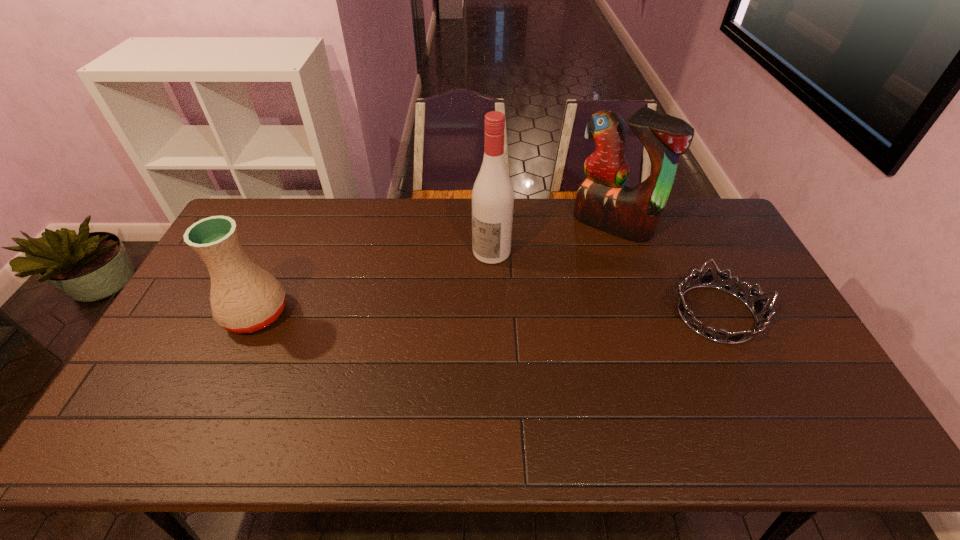
The height and width of the screenshot is (540, 960). Find the location of `pottery`. pottery is located at coordinates (244, 298).

Identify the location of the third tallest object. (244, 298).

At what (x,y) coordinates should I click in order to perform the action: click on the shortest object. Please return your answer as a coordinate pair (x, y). Looking at the image, I should click on (707, 279).

Where is `parrot`? This screenshot has width=960, height=540. parrot is located at coordinates (603, 200).

This screenshot has width=960, height=540. I want to click on the second object from left to right, so click(493, 195).

The height and width of the screenshot is (540, 960). Find the location of `free location located 0.060m on the right of the second shortest object`. free location located 0.060m on the right of the second shortest object is located at coordinates (310, 314).

I want to click on blank area located on the front-facing side of the tiara, so click(577, 314).

Where is `free space located 0.350m on the front-facing side of the tiara`? The height and width of the screenshot is (540, 960). free space located 0.350m on the front-facing side of the tiara is located at coordinates (549, 314).

This screenshot has height=540, width=960. I want to click on vacant area situated on the front-facing side of the tiara, so click(625, 314).

What are the coordinates of `vacant space situated 0.400m at the face of the second tallest object` in the screenshot? It's located at (532, 313).